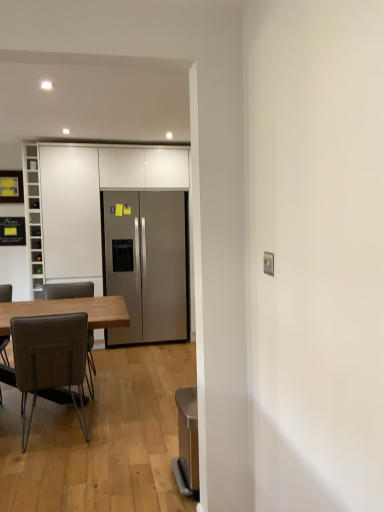
This screenshot has width=384, height=512. Identify the location of brown leather chair at left, marked as the second chair in a front-to-back arrangement. (68, 290).

Locate an element on the screen. This screenshot has height=512, width=384. brown leather chair at left, the 2th chair positioned from the back is located at coordinates (50, 358).

The width and height of the screenshot is (384, 512). Describe the element at coordinates (50, 358) in the screenshot. I see `brown leather chair at left, which appears as the 1th chair when viewed from the front` at that location.

The height and width of the screenshot is (512, 384). In order to click on wooden table at left in this screenshot , I will do `click(70, 311)`.

What do you see at coordinates (33, 218) in the screenshot? I see `white glass wine rack at left, which ranks as the 2th cabinetry in right-to-left order` at bounding box center [33, 218].

I want to click on brown leather chair at left, positioned as the first chair in back-to-front order, so click(68, 290).

Are satin silver refrigerator at center and metallic gray trash can at lower right far apart?

satin silver refrigerator at center is positioned a significant distance from metallic gray trash can at lower right.

Who is more distant, satin silver refrigerator at center or metallic gray trash can at lower right?

satin silver refrigerator at center.

Does point (172, 243) lie behind point (194, 429)?

Yes, point (172, 243) is behind point (194, 429).

This screenshot has width=384, height=512. Identify the location of appliance in front of the satin silver refrigerator at center. (187, 442).

Is wooden table at left beside satin silver refrigerator at center?

No, wooden table at left is not making contact with satin silver refrigerator at center.

Considering the relative sizes of wooden table at left and satin silver refrigerator at center in the image provided, is wooden table at left shorter than satin silver refrigerator at center?

Correct, wooden table at left is not as tall as satin silver refrigerator at center.

Image resolution: width=384 pixels, height=512 pixels. I want to click on refrigerator on the right of wooden table at left, so click(x=147, y=264).

From a real-world perspective, does wooden table at left stand above satin silver refrigerator at center?

No, from a real-world perspective, wooden table at left is not on top of satin silver refrigerator at center.

Which object is further away from the camera, metallic gray trash can at lower right or brown leather chair at left, the 2th chair positioned from the back?

brown leather chair at left, the 2th chair positioned from the back.

From a real-world perspective, is metallic gray trash can at lower right positioned over brown leather chair at left, which appears as the 1th chair when viewed from the front, based on gravity?

No, from a real-world perspective, metallic gray trash can at lower right is not above brown leather chair at left, which appears as the 1th chair when viewed from the front.

Is point (178, 420) closer or farther from the camera than point (28, 338)?

Clearly, point (178, 420) is more distant from the camera than point (28, 338).

From the picture: How many degrees apart are the facing directions of metallic gray trash can at lower right and brown leather chair at left, the 2th chair positioned from the back?

metallic gray trash can at lower right and brown leather chair at left, the 2th chair positioned from the back, are facing 3.68 degrees away from each other.

Is satin silver refrigerator at center turned away from brown leather chair at left, which appears as the 1th chair when viewed from the front?

No.

Between satin silver refrigerator at center and brown leather chair at left, which appears as the 1th chair when viewed from the front, which one has larger width?

satin silver refrigerator at center is wider.

Can you confirm if satin silver refrigerator at center is bigger than brown leather chair at left, the 2th chair positioned from the back?

Yes, satin silver refrigerator at center is bigger than brown leather chair at left, the 2th chair positioned from the back.

Is satin silver refrigerator at center placed right next to brown leather chair at left, the 2th chair positioned from the back?

No.

Is metallic gray trash can at lower right oriented away from white glossy cabinets at center, which is the second cabinetry in left-to-right order?

No, white glossy cabinets at center, which is the second cabinetry in left-to-right order, is not at the back of metallic gray trash can at lower right.

Locate an element on the screen. Image resolution: width=384 pixels, height=512 pixels. appliance that appears below the white glossy cabinets at center, which is the second cabinetry in left-to-right order (from the image's perspective) is located at coordinates [x=187, y=442].

Considering the sizes of metallic gray trash can at lower right and white glossy cabinets at center, which is the second cabinetry in left-to-right order, in the image, is metallic gray trash can at lower right taller or shorter than white glossy cabinets at center, which is the second cabinetry in left-to-right order,?

metallic gray trash can at lower right is shorter than white glossy cabinets at center, which is the second cabinetry in left-to-right order.

Locate an element on the screen. The image size is (384, 512). cabinetry that is the 2nd one when counting upward from the metallic gray trash can at lower right (from the image's perspective) is located at coordinates (33, 218).

How far apart are white glass wine rack at left, which ranks as the 2th cabinetry in right-to-left order, and metallic gray trash can at lower right?

white glass wine rack at left, which ranks as the 2th cabinetry in right-to-left order, is 8.99 feet from metallic gray trash can at lower right.

Which of these two, white glass wine rack at left, acting as the 1th cabinetry starting from the left, or metallic gray trash can at lower right, is smaller?

With smaller size is metallic gray trash can at lower right.

From a real-world perspective, is white glass wine rack at left, acting as the 1th cabinetry starting from the left, positioned above or below metallic gray trash can at lower right?

In terms of real-world spatial position, white glass wine rack at left, acting as the 1th cabinetry starting from the left, is above metallic gray trash can at lower right.

From the picture: Is white glass wine rack at left, which ranks as the 2th cabinetry in right-to-left order, completely or partially outside of brown leather chair at left, which appears as the 1th chair when viewed from the front?

white glass wine rack at left, which ranks as the 2th cabinetry in right-to-left order, is positioned outside brown leather chair at left, which appears as the 1th chair when viewed from the front.

Is white glass wine rack at left, which ranks as the 2th cabinetry in right-to-left order, oriented towards brown leather chair at left, which appears as the 1th chair when viewed from the front?

No, white glass wine rack at left, which ranks as the 2th cabinetry in right-to-left order, is not oriented towards brown leather chair at left, which appears as the 1th chair when viewed from the front.

From a real-world perspective, which object rests below the other?

From a 3D spatial view, brown leather chair at left, which appears as the 1th chair when viewed from the front, is below.

Image resolution: width=384 pixels, height=512 pixels. I want to click on appliance to the right of satin silver refrigerator at center, so click(x=187, y=442).

This screenshot has height=512, width=384. Identify the location of desk below the satin silver refrigerator at center (from a real-world perspective). (70, 311).

From the image, which object appears to be farther from wooden table at left, brown leather chair at left, positioned as the first chair in back-to-front order, or brown leather chair at left, the 2th chair positioned from the back?

The object further to wooden table at left is brown leather chair at left, positioned as the first chair in back-to-front order.

Considering their positions, is metallic gray trash can at lower right positioned closer to satin silver refrigerator at center than white glossy cabinets at center, the first cabinetry viewed from the right?

white glossy cabinets at center, the first cabinetry viewed from the right, is closer to satin silver refrigerator at center.

Estimate the real-world distances between objects in this image. Which object is further from brown leather chair at left, which appears as the 1th chair when viewed from the front, metallic gray trash can at lower right or satin silver refrigerator at center?

Among the two, satin silver refrigerator at center is located further to brown leather chair at left, which appears as the 1th chair when viewed from the front.

Based on their spatial positions, is brown leather chair at left, the 2th chair positioned from the back, or brown leather chair at left, positioned as the first chair in back-to-front order, further from wooden table at left?

Based on the image, brown leather chair at left, positioned as the first chair in back-to-front order, appears to be further to wooden table at left.

Looking at the image, which one is located closer to brown leather chair at left, which appears as the 1th chair when viewed from the front, white glossy cabinets at center, the first cabinetry viewed from the right, or metallic gray trash can at lower right?

metallic gray trash can at lower right is positioned closer to the anchor brown leather chair at left, which appears as the 1th chair when viewed from the front.

Based on their spatial positions, is brown leather chair at left, which appears as the 1th chair when viewed from the front, or white glass wine rack at left, which ranks as the 2th cabinetry in right-to-left order, closer to metallic gray trash can at lower right?

Based on the image, brown leather chair at left, which appears as the 1th chair when viewed from the front, appears to be nearer to metallic gray trash can at lower right.

Considering their positions, is brown leather chair at left, the 2th chair positioned from the back, positioned further to white glass wine rack at left, which ranks as the 2th cabinetry in right-to-left order, than satin silver refrigerator at center?

brown leather chair at left, the 2th chair positioned from the back, is positioned further to the anchor white glass wine rack at left, which ranks as the 2th cabinetry in right-to-left order.

Looking at the image, which one is located closer to white glossy cabinets at center, the first cabinetry viewed from the right, white glass wine rack at left, which ranks as the 2th cabinetry in right-to-left order, or satin silver refrigerator at center?

Based on the image, white glass wine rack at left, which ranks as the 2th cabinetry in right-to-left order, appears to be nearer to white glossy cabinets at center, the first cabinetry viewed from the right.

Image resolution: width=384 pixels, height=512 pixels. I want to click on cabinetry positioned between metallic gray trash can at lower right and white glass wine rack at left, which ranks as the 2th cabinetry in right-to-left order, from near to far, so click(91, 199).

Find the location of `cabinetry between brown leather chair at left, which appears as the 1th chair when viewed from the front, and white glass wine rack at left, acting as the 1th cabinetry starting from the left, from front to back`. cabinetry between brown leather chair at left, which appears as the 1th chair when viewed from the front, and white glass wine rack at left, acting as the 1th cabinetry starting from the left, from front to back is located at coordinates (91, 199).

Find the location of a particular element. This screenshot has height=512, width=384. chair positioned between wooden table at left and white glossy cabinets at center, which is the second cabinetry in left-to-right order, from near to far is located at coordinates (68, 290).

In order to click on chair located between brown leather chair at left, the 2th chair positioned from the back, and white glass wine rack at left, acting as the 1th cabinetry starting from the left, in the depth direction in this screenshot , I will do `click(68, 290)`.